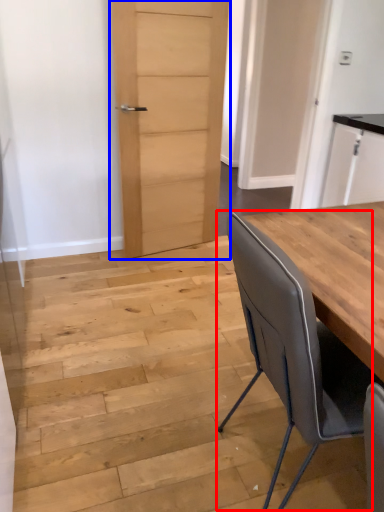
Question: Which object is further to the camera taking this photo, chair (highlighted by a red box) or door (highlighted by a blue box)?

Choices:
 (A) chair
 (B) door

Answer: (B)